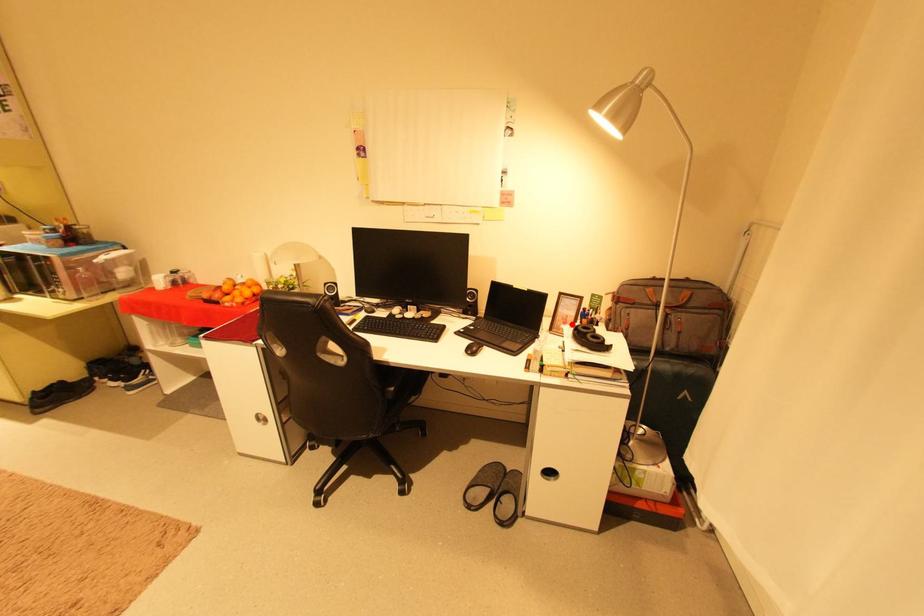
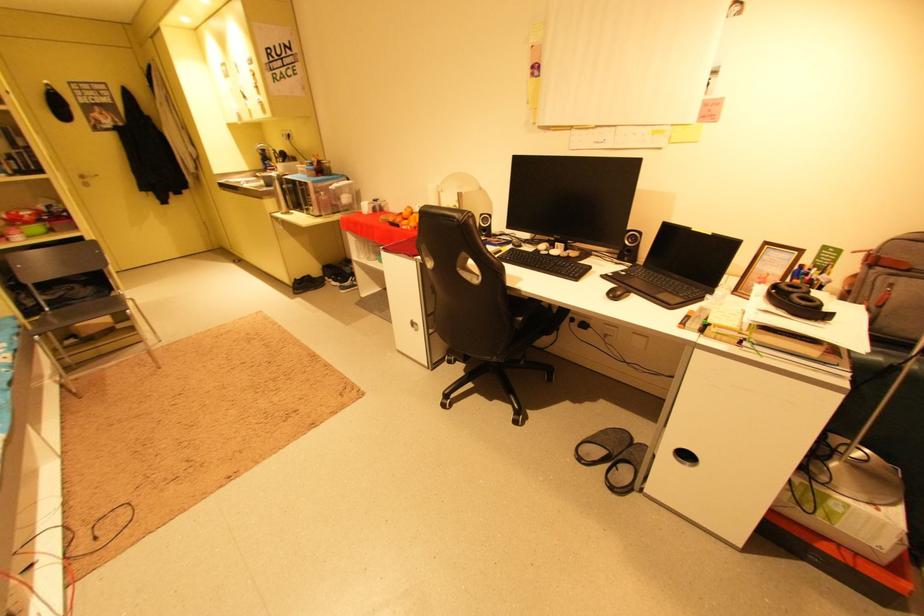
Where in the second image is the point corresponding to the highlighted location from the first image?

(769, 285)